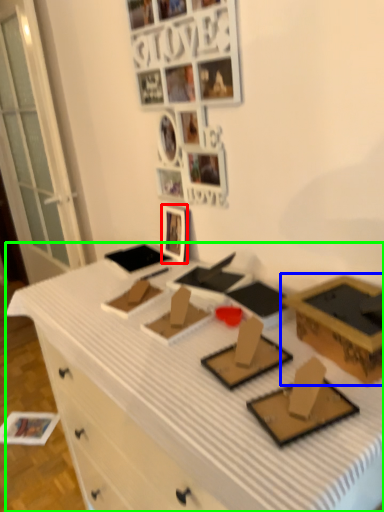
Question: Considering the real-world distances, which object is closest to picture frame (highlighted by a red box)? box (highlighted by a blue box) or desk (highlighted by a green box).

Choices:
 (A) box
 (B) desk

Answer: (B)